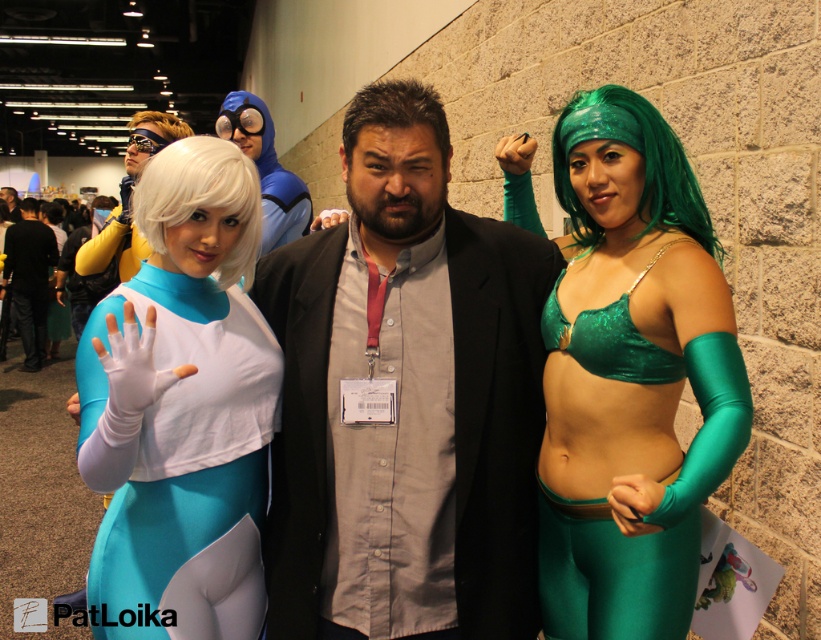
Question: Considering the relative positions of white synthetic wig at left and blonde wig at upper left in the image provided, where is white synthetic wig at left located with respect to blonde wig at upper left?

Choices:
 (A) right
 (B) left

Answer: (A)

Question: Does white synthetic wig at left appear under green shiny wig at right?

Choices:
 (A) yes
 (B) no

Answer: (A)

Question: Estimate the real-world distances between objects in this image. Which object is closer to the dark brown hair at center?

Choices:
 (A) green shiny wig at right
 (B) blonde wig at upper left

Answer: (A)

Question: Which point appears closest to the camera in this image?

Choices:
 (A) (31, 336)
 (B) (200, 140)

Answer: (B)

Question: Does matte white costume at left lie in front of matte black suit at center?

Choices:
 (A) yes
 (B) no

Answer: (A)

Question: Which object is positioned closest to the green shiny wig at right?

Choices:
 (A) dark brown hair at center
 (B) blonde wig at upper left

Answer: (A)